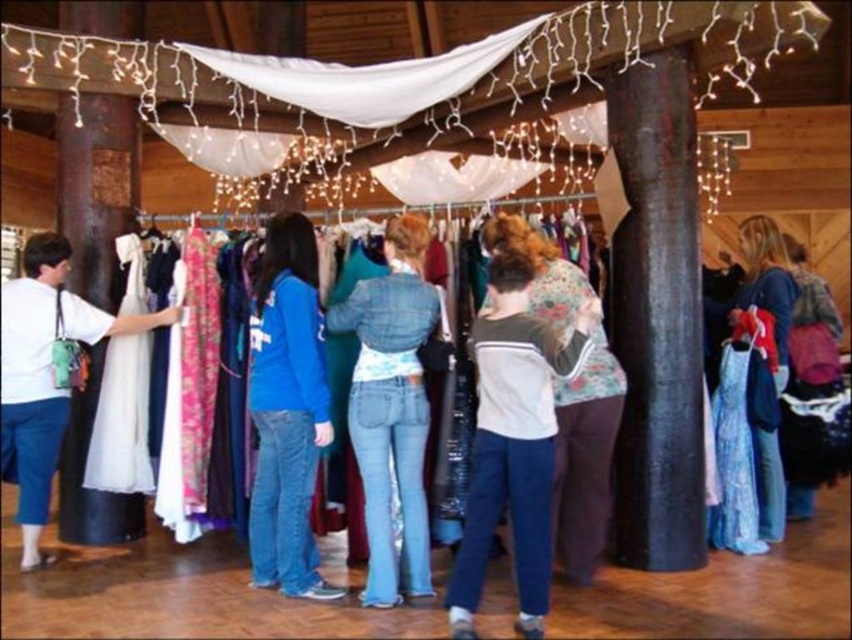
Which of these two, white matte dress at left or velvet purple dress at right, stands taller?

With more height is velvet purple dress at right.

Between white matte dress at left and velvet purple dress at right, which one is positioned lower?

white matte dress at left is below.

Is point (20, 316) more distant than point (803, 264)?

No, it is not.

Image resolution: width=852 pixels, height=640 pixels. Identify the location of white matte dress at left. (30, 392).

Can you confirm if denim jeans at center is positioned below floral-patterned sweater at center?

Correct, denim jeans at center is located below floral-patterned sweater at center.

Is denim jeans at center above floral-patterned sweater at center?

Incorrect, denim jeans at center is not positioned above floral-patterned sweater at center.

Measure the distance between denim jeans at center and camera.

3.67 meters

Identify the location of denim jeans at center. The height and width of the screenshot is (640, 852). (390, 420).

Can you confirm if denim jeans at center is wider than white satin dress at left?

No, denim jeans at center is not wider than white satin dress at left.

Find the location of a particular element. The height and width of the screenshot is (640, 852). denim jeans at center is located at coordinates (390, 420).

Is point (406, 470) less distant than point (50, 256)?

That is True.

The height and width of the screenshot is (640, 852). Identify the location of denim jeans at center. (390, 420).